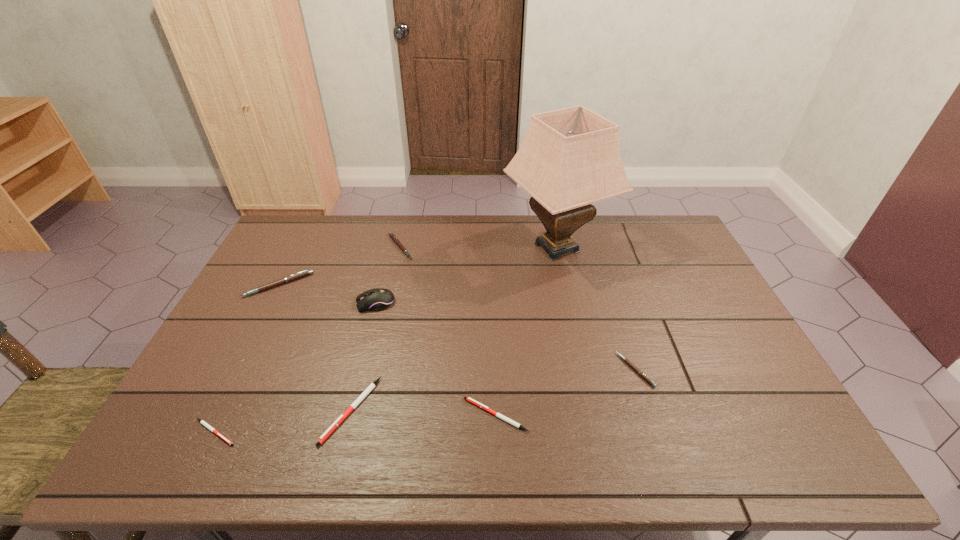
Where is `empty space that is in between the second pen from right to left and the second farthest pink pen`? empty space that is in between the second pen from right to left and the second farthest pink pen is located at coordinates (388, 350).

This screenshot has height=540, width=960. Find the location of `vacant space that is in between the second pen from right to left and the sixth shortest object`. vacant space that is in between the second pen from right to left and the sixth shortest object is located at coordinates (388, 350).

Find the location of a particular element. This screenshot has width=960, height=540. vacant space in between the brown lampshade and the third tallest object is located at coordinates (418, 266).

The height and width of the screenshot is (540, 960). I want to click on object that ranks as the third closest to the black computer mouse, so click(x=325, y=435).

Where is `the third closest object to the second white pen from left to right`? The width and height of the screenshot is (960, 540). the third closest object to the second white pen from left to right is located at coordinates (377, 299).

Locate an element on the screen. This screenshot has width=960, height=540. the second closest pen to the biggest white pen is located at coordinates (504, 418).

You are a GUI agent. You are given a task and a screenshot of the screen. Output one action in this format:
    pyautogui.click(x=<x>, y=<y>)
    Task: Click on the third closest pen to the rightmost white pen
    Image resolution: width=960 pixels, height=540 pixels.
    Given the screenshot: What is the action you would take?
    pyautogui.click(x=202, y=422)

Where is `pink pen object that ranks as the third closest to the rightmost white pen`? The width and height of the screenshot is (960, 540). pink pen object that ranks as the third closest to the rightmost white pen is located at coordinates (304, 273).

Select which pink pen appears as the closest to the second biggest pink pen. Please provide its 2D coordinates. Your answer should be formatted as a tuple, i.e. [(x, y)], where the tuple contains the x and y coordinates of a point satisfying the conditions above.

[(304, 273)]

The image size is (960, 540). In order to click on white pen that is the second closest to the black computer mouse in this screenshot , I will do `click(504, 418)`.